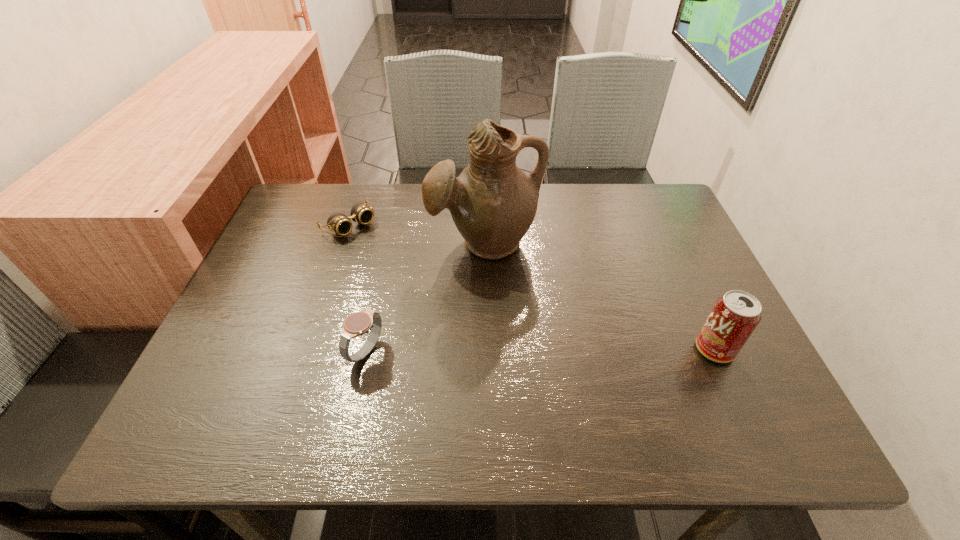
The width and height of the screenshot is (960, 540). In order to click on object present at the left edge in this screenshot , I will do `click(338, 222)`.

You are a GUI agent. You are given a task and a screenshot of the screen. Output one action in this format:
    pyautogui.click(x=<x>, y=<y>)
    Task: Click on the object that is at the right edge
    This screenshot has height=540, width=960.
    Given the screenshot: What is the action you would take?
    pyautogui.click(x=735, y=315)

This screenshot has width=960, height=540. Identify the location of object that is at the far left corner. (338, 222).

Locate an element on the screen. Image resolution: width=960 pixels, height=540 pixels. object located in the near right corner section of the desktop is located at coordinates (735, 315).

The image size is (960, 540). Identify the location of vacant space at the far edge of the desktop. (613, 203).

Where is `free location at the near edge`? Image resolution: width=960 pixels, height=540 pixels. free location at the near edge is located at coordinates (381, 380).

Locate an element on the screen. Image resolution: width=960 pixels, height=540 pixels. vacant space at the right edge of the desktop is located at coordinates (677, 251).

In order to click on free space at the far left corner in this screenshot , I will do `click(303, 200)`.

At what (x,y) coordinates should I click in order to perform the action: click on free space at the near left corner of the desktop. Please return your answer as a coordinate pair (x, y). Looking at the image, I should click on (276, 370).

The height and width of the screenshot is (540, 960). I want to click on vacant space at the far right corner of the desktop, so click(x=619, y=214).